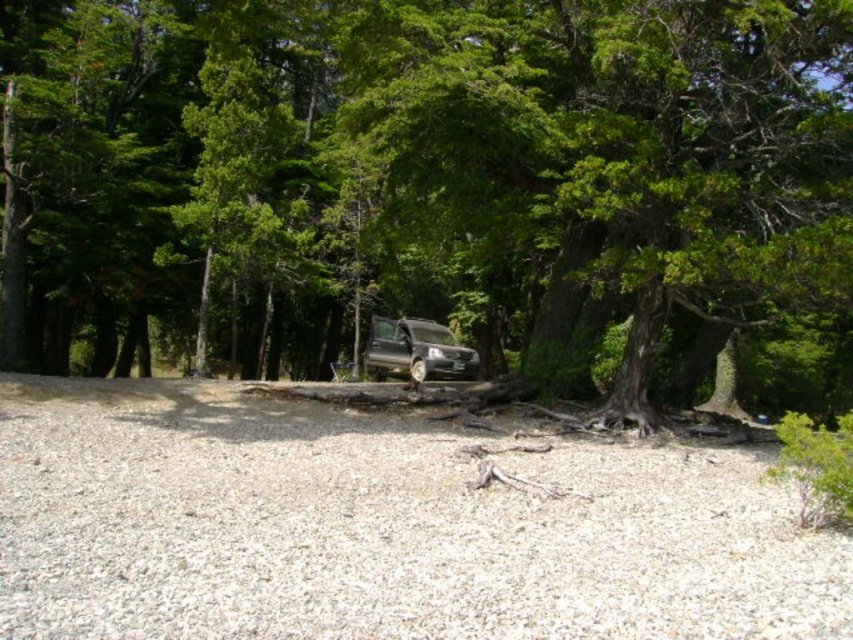
Can you confirm if gray gravel at center is shorter than metallic silver van at center?

No.

Which is behind, point (674, 611) or point (428, 348)?

The point (428, 348) is more distant.

This screenshot has width=853, height=640. I want to click on gray gravel at center, so click(380, 528).

Between green leafy tree at center and gray gravel at center, which one has more height?

green leafy tree at center

Locate an element on the screen. The width and height of the screenshot is (853, 640). green leafy tree at center is located at coordinates (430, 184).

Does point (173, 52) come behind point (22, 560)?

Yes.

You are a GUI agent. You are given a task and a screenshot of the screen. Output one action in this format:
    pyautogui.click(x=<x>, y=<y>)
    Task: Click on the green leafy tree at center
    This screenshot has width=853, height=640.
    Given the screenshot: What is the action you would take?
    pyautogui.click(x=430, y=184)

Does green leafy tree at center have a smaller size compared to metallic silver van at center?

No, green leafy tree at center is not smaller than metallic silver van at center.

Is point (181, 161) farther from camera compared to point (463, 369)?

Yes.

Image resolution: width=853 pixels, height=640 pixels. I want to click on green leafy tree at center, so click(430, 184).